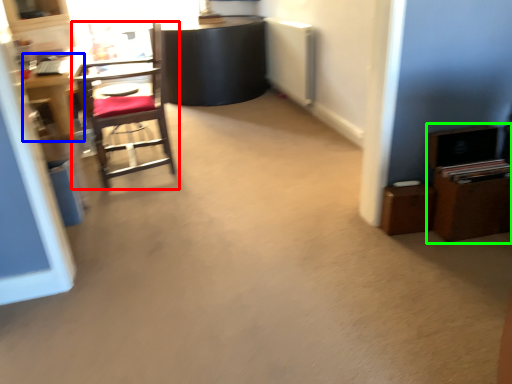
Question: Considering the real-world distances, which object is closest to chair (highlighted by a red box)? desk (highlighted by a blue box) or dresser (highlighted by a green box).

Choices:
 (A) desk
 (B) dresser

Answer: (A)